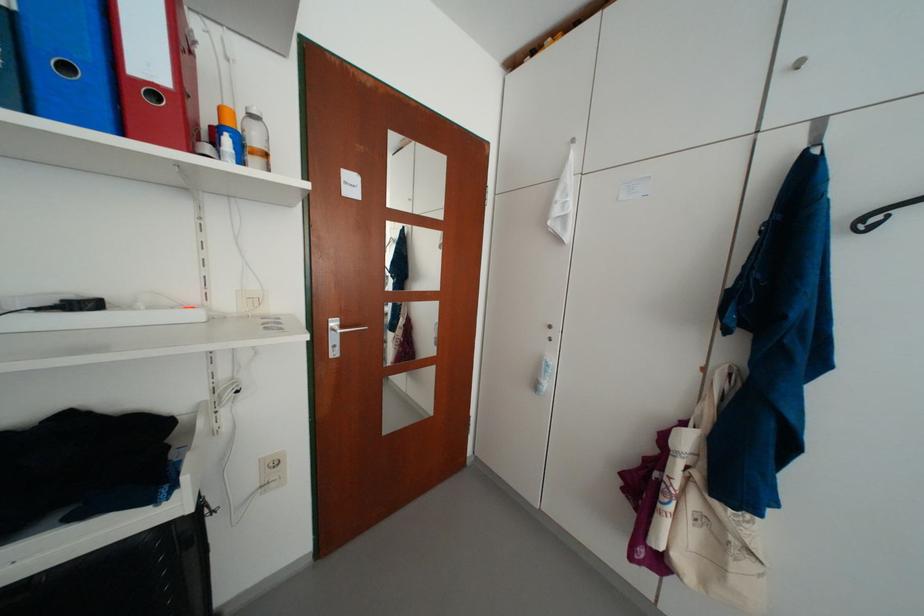
Identify the location of black cabinet hook. The image size is (924, 616). (880, 215).